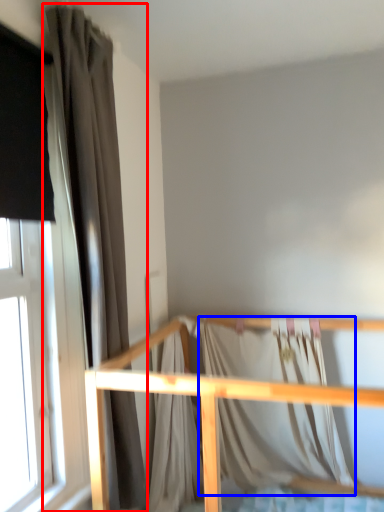
Question: Which point is closer to the camera, curtain (highlighted by a red box) or blanket (highlighted by a blue box)?

Choices:
 (A) curtain
 (B) blanket

Answer: (A)